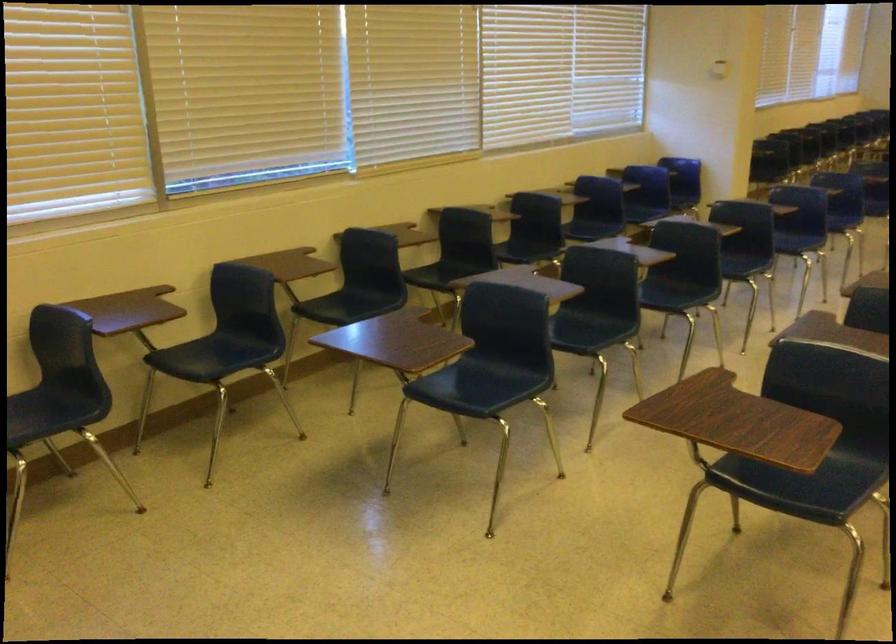
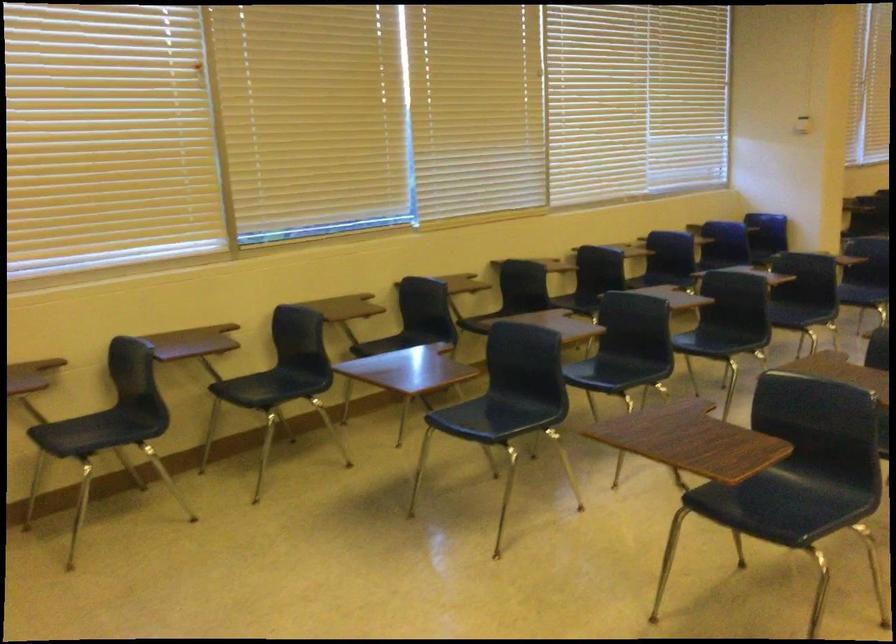
Which direction would the cameraman need to move to produce the second image?

The cameraman moved toward right, backward.